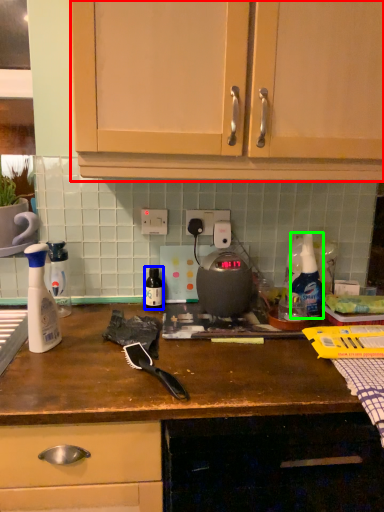
Question: Which object is positioned farthest from cabinetry (highlighted by a red box)? Select from bottle (highlighted by a blue box) and cleaning product (highlighted by a green box).

Choices:
 (A) bottle
 (B) cleaning product

Answer: (A)